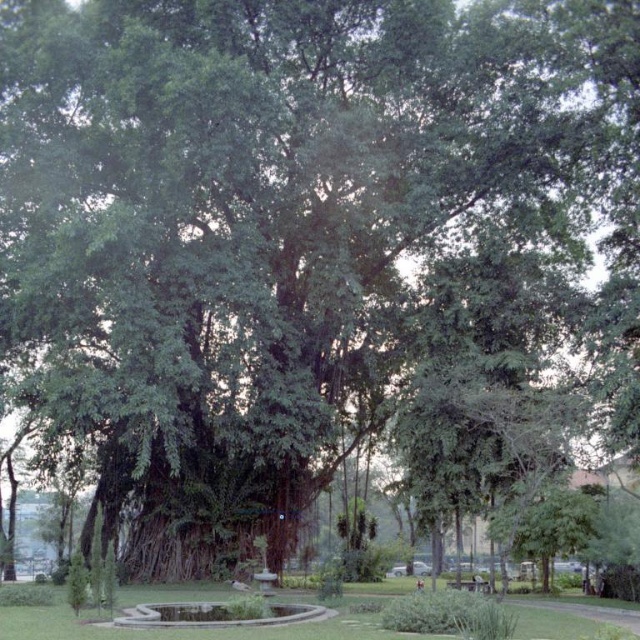
Does green grass at center appear under wooden park bench at center?

No, green grass at center is not below wooden park bench at center.

Can you confirm if green grass at center is shorter than wooden park bench at center?

No.

At what (x,y) coordinates should I click in order to perform the action: click on green grass at center. Please return your answer as a coordinate pair (x, y). Looking at the image, I should click on [202, 628].